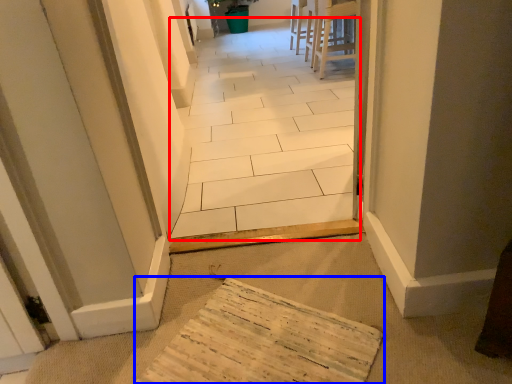
Question: Which of the following is the farthest to the observer, path (highlighted by a red box) or cardboard (highlighted by a blue box)?

Choices:
 (A) path
 (B) cardboard

Answer: (A)